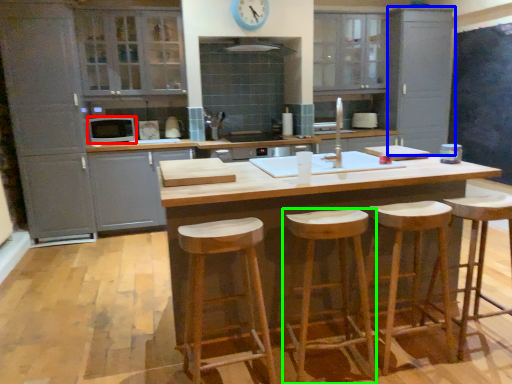
Question: Estimate the real-world distances between objects in this image. Which object is farther from appliance (highlighted by a red box), cabinetry (highlighted by a blue box) or stool (highlighted by a green box)?

Choices:
 (A) cabinetry
 (B) stool

Answer: (A)